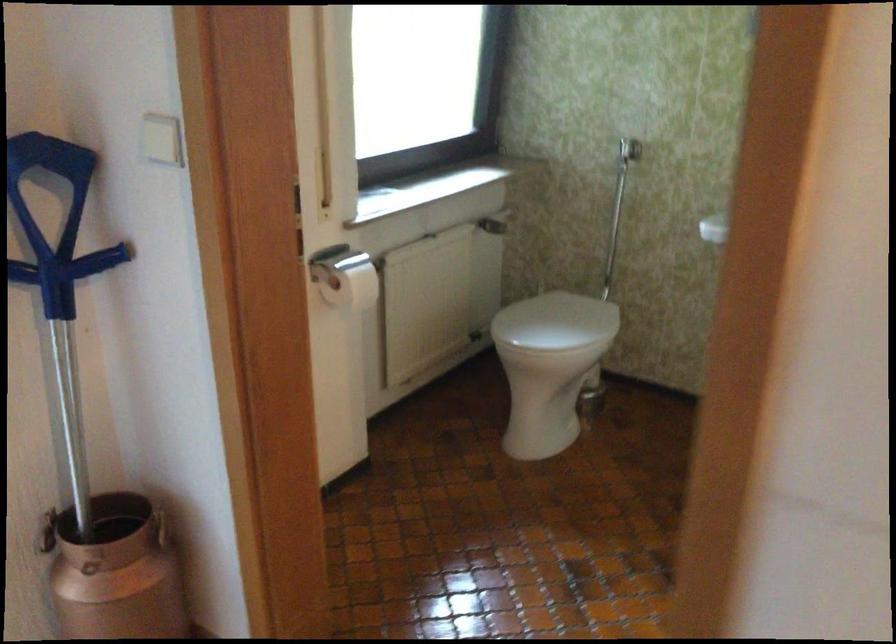
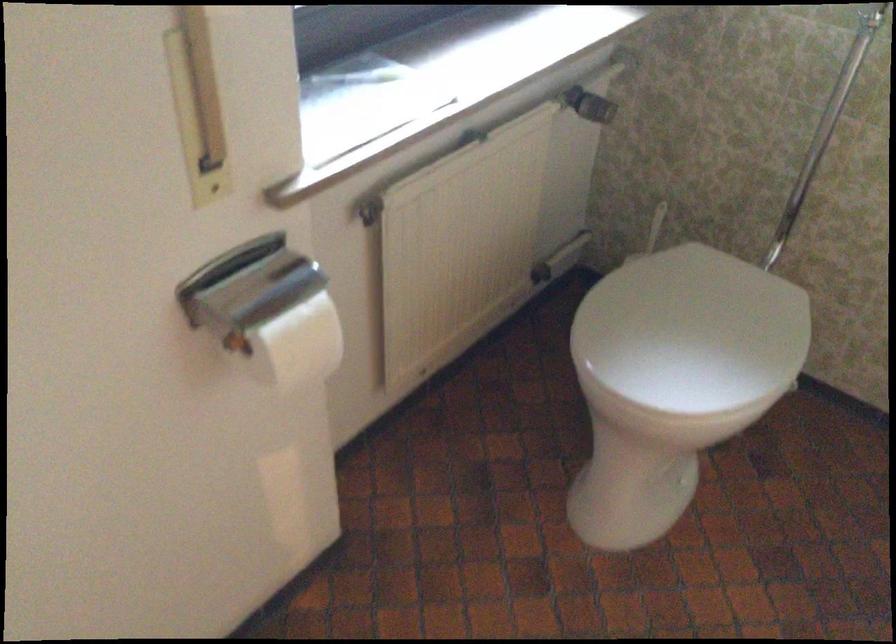
In the second image, find the point that corresponds to (373,266) in the first image.

(368, 212)